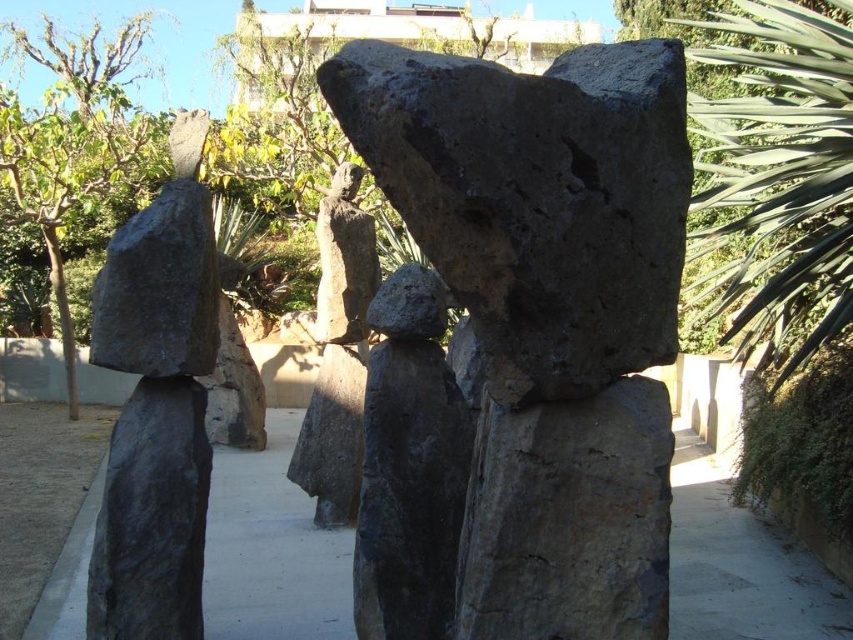
What do you see at coordinates (271, 550) in the screenshot?
I see `dark gray stone path at center` at bounding box center [271, 550].

Is point (676, 483) positioned behind point (193, 340)?

Yes, point (676, 483) is behind point (193, 340).

Image resolution: width=853 pixels, height=640 pixels. Identify the location of dark gray stone path at center. (271, 550).

This screenshot has width=853, height=640. Describe the element at coordinates (535, 196) in the screenshot. I see `dark gray stone boulder at center` at that location.

Does dark gray stone boulder at center appear under dark gray stone boulder at left?

Actually, dark gray stone boulder at center is above dark gray stone boulder at left.

Who is more distant from viewer, (364, 140) or (126, 346)?

Positioned behind is point (126, 346).

I want to click on dark gray stone boulder at center, so click(x=535, y=196).

Does dark gray stone boulder at left appear on the right side of rough stone statue at center?

No, dark gray stone boulder at left is not to the right of rough stone statue at center.

Where is `dark gray stone boulder at left`? The height and width of the screenshot is (640, 853). dark gray stone boulder at left is located at coordinates (160, 289).

This screenshot has height=640, width=853. Identify the location of dark gray stone boulder at left. (160, 289).